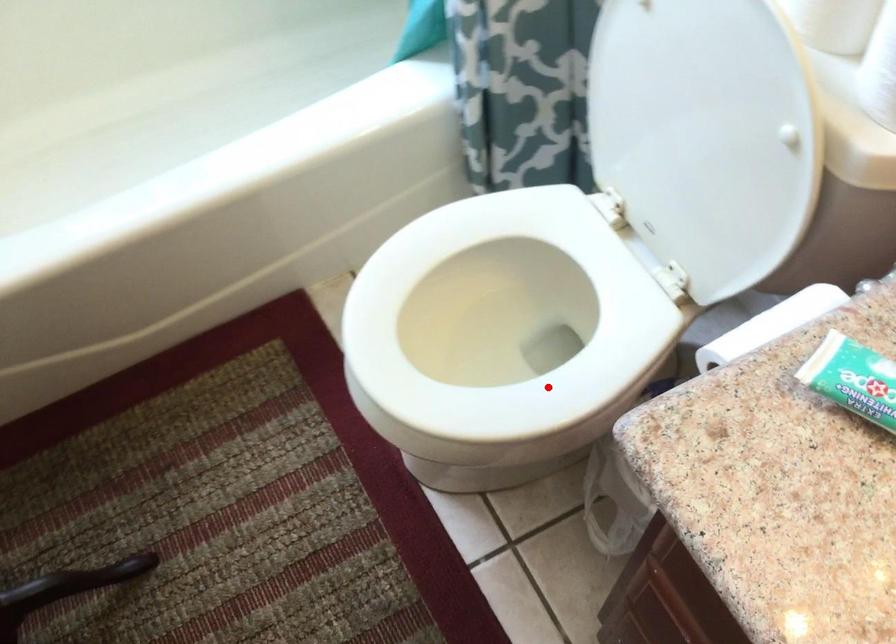
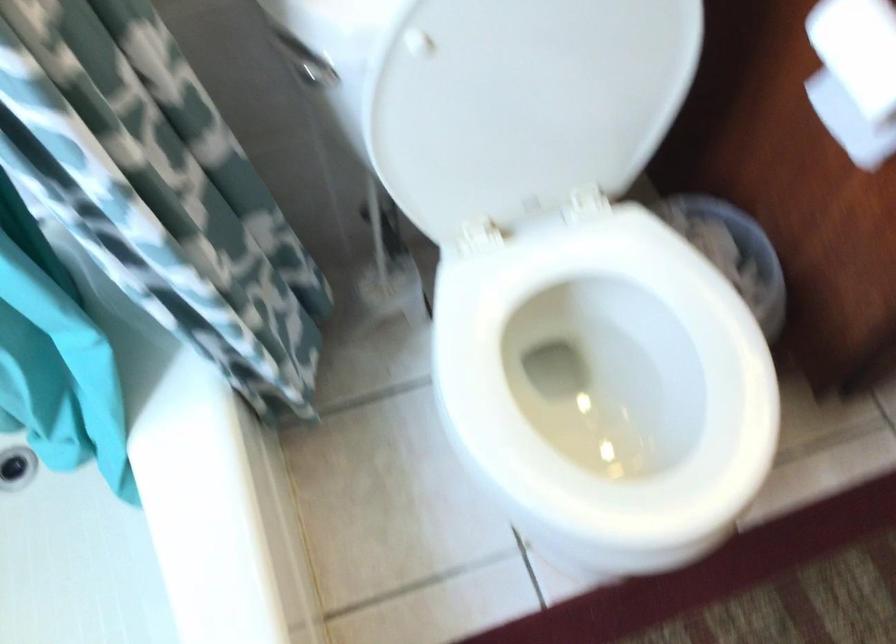
In the second image, find the point that corresponds to the highlighted location in the first image.

(606, 375)